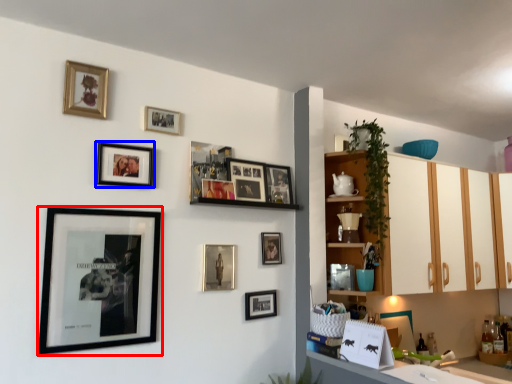
Question: Among these objects, which one is farthest to the camera, picture frame (highlighted by a red box) or picture frame (highlighted by a blue box)?

Choices:
 (A) picture frame
 (B) picture frame

Answer: (B)